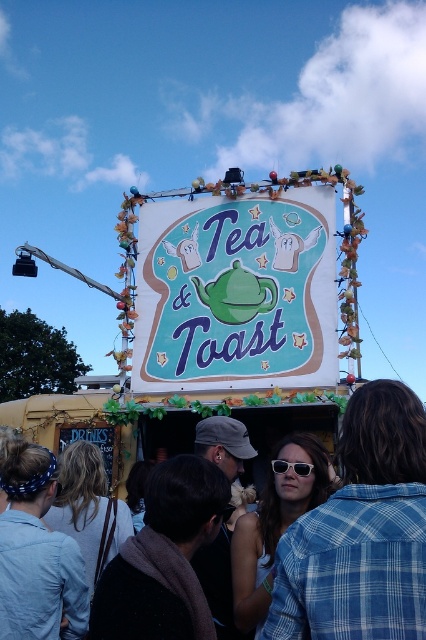
In the scene shown: You are a customer at the Tea and Toast stall. You see the teal fabric sign at center and the denim jacket at lower right. Which object is bigger?

The teal fabric sign at center is larger than the denim jacket at lower right.

You are standing in front of the Tea and Toast stall and want to locate the denim jacket at lower right. According to the coordinates given, where should you look to find it?

The denim jacket at lower right is located at point (362, 531).

You are standing at the Tea and Toast stall and want to place a new decoration. You have two points marked on the stall wall at point (172,308) and point (276,474). Which point is closer to you?

Point (172,308) is closer to you than point (276,474) because it is further to the viewer.